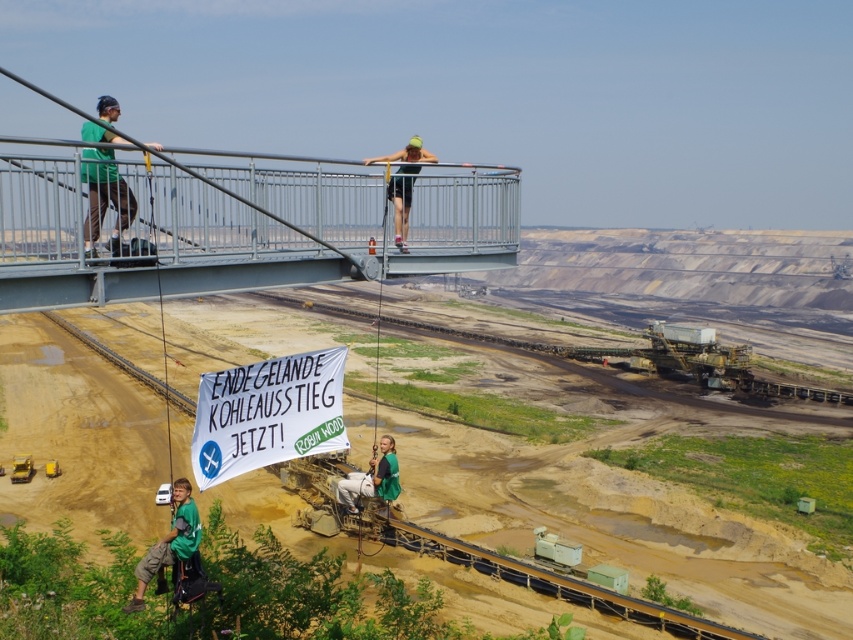
Describe the element at coordinates (167, 545) in the screenshot. I see `green matte shirt at lower left` at that location.

Is green matte shirt at lower left thinner than green fabric at lower center?

Indeed, green matte shirt at lower left has a lesser width compared to green fabric at lower center.

The height and width of the screenshot is (640, 853). I want to click on green matte shirt at lower left, so click(167, 545).

Can you confirm if green matte shirt at left is bigger than green fabric at lower center?

Indeed, green matte shirt at left has a larger size compared to green fabric at lower center.

Can you confirm if green matte shirt at left is positioned to the left of green fabric at lower center?

Yes, green matte shirt at left is to the left of green fabric at lower center.

Consider the image. Who is more forward, [103,188] or [387,460]?

Point [103,188] is more forward.

The height and width of the screenshot is (640, 853). I want to click on green matte shirt at left, so click(105, 204).

Find the location of a particular element. This screenshot has height=640, width=853. green fabric shorts at center is located at coordinates (403, 184).

Which is more to the right, green fabric shorts at center or green fabric at lower center?

green fabric shorts at center is more to the right.

Which is in front, point (389, 196) or point (392, 458)?

Point (389, 196) is more forward.

You are a GUI agent. You are given a task and a screenshot of the screen. Output one action in this format:
    pyautogui.click(x=<x>, y=<y>)
    Task: Click on the green fabric shorts at center
    This screenshot has width=853, height=640.
    Given the screenshot: What is the action you would take?
    pyautogui.click(x=403, y=184)